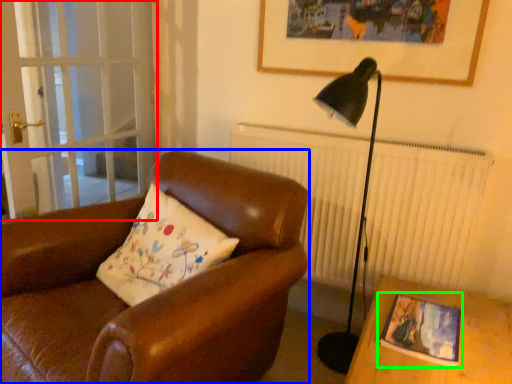
Question: Considering the real-world distances, which object is closest to screen door (highlighted by a red box)? chair (highlighted by a blue box) or picture frame (highlighted by a green box).

Choices:
 (A) chair
 (B) picture frame

Answer: (A)